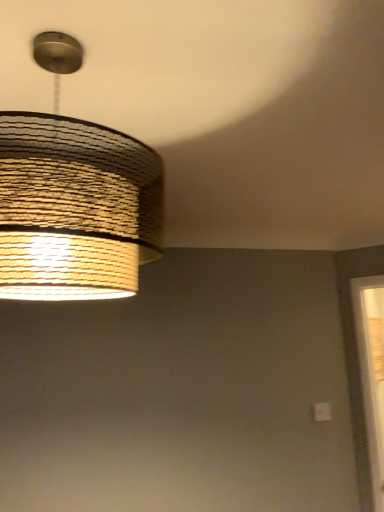
What do you see at coordinates (74, 198) in the screenshot?
I see `woven paper lampshade at upper left` at bounding box center [74, 198].

Find the location of a particular element. woven paper lampshade at upper left is located at coordinates (74, 198).

In order to click on woven paper lampshade at upper left in this screenshot , I will do `click(74, 198)`.